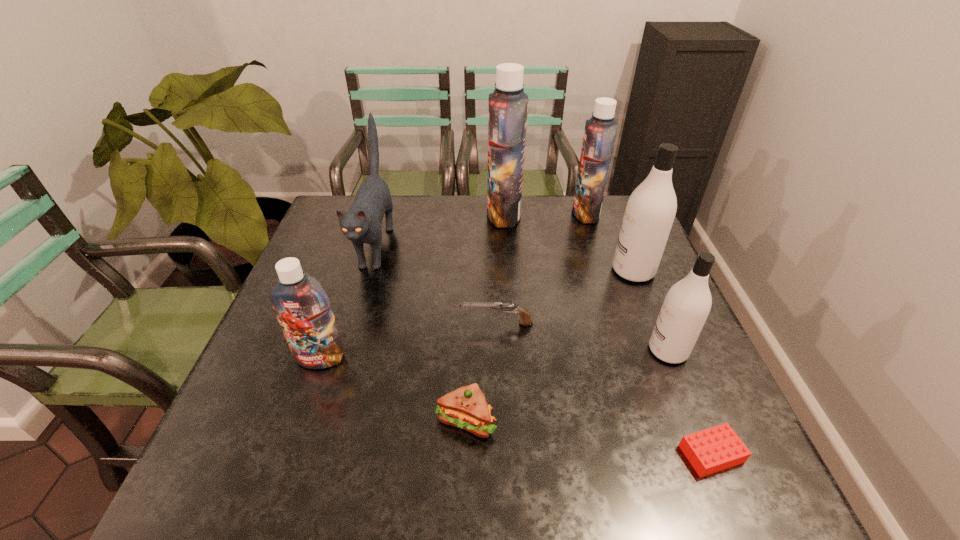
I want to click on the second shortest object, so click(x=505, y=306).

You are a GUI agent. You are given a task and a screenshot of the screen. Output one action in this format:
    pyautogui.click(x=<x>, y=<y>)
    Task: Click on the fifth farthest object
    This screenshot has height=540, width=960.
    Given the screenshot: What is the action you would take?
    pyautogui.click(x=505, y=306)

Image resolution: width=960 pixels, height=540 pixels. Identify the location of Lego. (714, 449).

At what (x,y) coordinates should I click in order to perform the action: click on vacant space located 0.270m on the front label of the tallest shampoo. Please return your answer as a coordinate pair (x, y). Looking at the image, I should click on (403, 214).

The width and height of the screenshot is (960, 540). What are the coordinates of `free space located on the front label of the tallest shampoo` in the screenshot? It's located at (413, 214).

Find the location of a particular element. The image size is (960, 540). free space located 0.210m on the front label of the tallest shampoo is located at coordinates (421, 214).

The width and height of the screenshot is (960, 540). What are the coordinates of `free space located 0.320m on the front label of the second biggest blue shampoo` in the screenshot? It's located at (473, 213).

The image size is (960, 540). Find the location of `vacant area situated 0.210m on the front label of the second biggest blue shampoo`. vacant area situated 0.210m on the front label of the second biggest blue shampoo is located at coordinates (508, 213).

Find the location of `free space located 0.280m on the front label of the second biggest blue shampoo`. free space located 0.280m on the front label of the second biggest blue shampoo is located at coordinates (x=486, y=213).

You are a GUI agent. You are given a task and a screenshot of the screen. Output one action in this format:
    pyautogui.click(x=<x>, y=<y>)
    Task: Click on the vacant region located on the front-facing side of the bigger white shampoo
    The height and width of the screenshot is (540, 960).
    Given the screenshot: What is the action you would take?
    pyautogui.click(x=488, y=271)